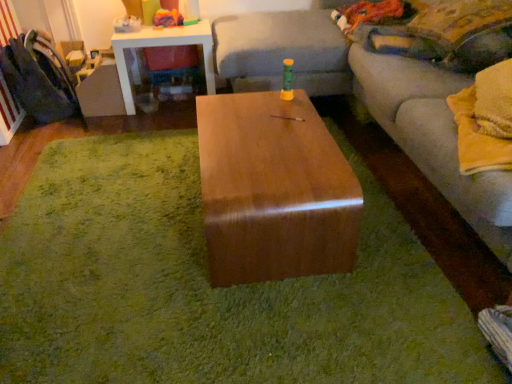
In order to face brown glossy wood table at center, should I rotate leftwards or rightwards?

Rotate left and turn 6.972 degrees.

Where is `shiny brown wood coffee table at center`? shiny brown wood coffee table at center is located at coordinates (274, 190).

Where is `white glossy side table at upper left`? The image size is (512, 384). white glossy side table at upper left is located at coordinates (162, 46).

Consider the image. Measure the distance between point (188, 21) and camera.

Point (188, 21) and camera are 8.64 feet apart from each other.

Identify the location of matte gray couch at center. (371, 101).

Identify the location of velvet yellow pillow at upper right. (459, 22).

Between brown glossy wood table at center and shiny brown wood coffee table at center, which one has smaller size?

brown glossy wood table at center.

Considering the relative sizes of brown glossy wood table at center and shiny brown wood coffee table at center in the image provided, is brown glossy wood table at center taller than shiny brown wood coffee table at center?

No.

Is brown glossy wood table at center positioned behind shiny brown wood coffee table at center?

No, brown glossy wood table at center is closer to the camera.

From a real-world perspective, which object rests below the other?

brown glossy wood table at center.

From a real-world perspective, which object rests below the other?

From a 3D spatial view, rubberized plastic toy at upper left is below.

From the image's perspective, is rubberized plastic toy at upper left located beneath velvet yellow pillow at upper right?

No, from the image's perspective, rubberized plastic toy at upper left is not below velvet yellow pillow at upper right.

Is velvet yellow pillow at upper right at the back of rubberized plastic toy at upper left?

rubberized plastic toy at upper left does not have its back to velvet yellow pillow at upper right.

This screenshot has width=512, height=384. Identify the location of pillow above the rubberized plastic toy at upper left (from a real-world perspective). (459, 22).

Could you tell me if shiny brown wood coffee table at center is facing white glossy side table at upper left?

No, shiny brown wood coffee table at center does not turn towards white glossy side table at upper left.

From the picture: Who is shorter, shiny brown wood coffee table at center or white glossy side table at upper left?

shiny brown wood coffee table at center.

Is white glossy side table at upper left surrounded by shiny brown wood coffee table at center?

No, white glossy side table at upper left is located outside of shiny brown wood coffee table at center.

Considering the relative sizes of shiny brown wood coffee table at center and white glossy side table at upper left in the image provided, is shiny brown wood coffee table at center thinner than white glossy side table at upper left?

Yes, shiny brown wood coffee table at center is thinner than white glossy side table at upper left.

Is velvet yellow pillow at upper right oriented away from shiny brown wood coffee table at center?

No, velvet yellow pillow at upper right is not facing the opposite direction of shiny brown wood coffee table at center.

How distant is velvet yellow pillow at upper right from shiny brown wood coffee table at center?

A distance of 97.72 centimeters exists between velvet yellow pillow at upper right and shiny brown wood coffee table at center.

Which is more to the left, velvet yellow pillow at upper right or shiny brown wood coffee table at center?

Positioned to the left is shiny brown wood coffee table at center.

Between velvet yellow pillow at upper right and shiny brown wood coffee table at center, which one has larger size?

shiny brown wood coffee table at center is bigger.

Is white glossy side table at upper left oriented away from shiny brown wood coffee table at center?

No.

Does white glossy side table at upper left have a greater width compared to shiny brown wood coffee table at center?

Yes, white glossy side table at upper left is wider than shiny brown wood coffee table at center.

Where is `table on the left of the shiny brown wood coffee table at center`? This screenshot has height=384, width=512. table on the left of the shiny brown wood coffee table at center is located at coordinates (162, 46).

From the image's perspective, is white glossy side table at upper left positioned above or below shiny brown wood coffee table at center?

From the image's perspective, white glossy side table at upper left appears above shiny brown wood coffee table at center.

From the image's perspective, which object appears higher, brown glossy wood table at center or matte gray couch at center?

From the image's view, matte gray couch at center is above.

Considering the relative positions of brown glossy wood table at center and matte gray couch at center in the image provided, is brown glossy wood table at center in front of matte gray couch at center?

No, it is not.

Identify the location of studio couch above the brown glossy wood table at center (from the image's perspective). This screenshot has height=384, width=512. (371, 101).

In the scene shown: Is brown glossy wood table at center oriented away from matte gray couch at center?

No, brown glossy wood table at center's orientation is not away from matte gray couch at center.

Which is more to the left, white glossy side table at upper left or brown glossy wood table at center?

white glossy side table at upper left.

Is white glossy side table at upper left next to brown glossy wood table at center?

No, white glossy side table at upper left is not in contact with brown glossy wood table at center.

Considering the sizes of objects white glossy side table at upper left and brown glossy wood table at center in the image provided, who is smaller, white glossy side table at upper left or brown glossy wood table at center?

brown glossy wood table at center is smaller.

Would you say white glossy side table at upper left is inside or outside brown glossy wood table at center?

white glossy side table at upper left exists outside the volume of brown glossy wood table at center.

The width and height of the screenshot is (512, 384). Find the location of `mat lying in front of the shiny brown wood coffee table at center`. mat lying in front of the shiny brown wood coffee table at center is located at coordinates (208, 287).

You are a GUI agent. You are given a task and a screenshot of the screen. Output one action in this format:
    pyautogui.click(x=<x>, y=<y>)
    Task: Click on the toy behind the velvet yellow pillow at upper right
    
    Given the screenshot: What is the action you would take?
    pyautogui.click(x=172, y=19)

From the image, which object appears to be nearer to matte gray couch at center, shiny brown wood coffee table at center or white glossy side table at upper left?

shiny brown wood coffee table at center.

Considering their positions, is velvet yellow pillow at upper right positioned closer to white glossy side table at upper left than velvet dark blue swivel chair at left?

Among the two, velvet dark blue swivel chair at left is located nearer to white glossy side table at upper left.

Based on their spatial positions, is rubberized plastic toy at upper left or white glossy side table at upper left further from velvet dark blue swivel chair at left?

rubberized plastic toy at upper left.

Consider the image. Considering their positions, is brown glossy wood table at center positioned closer to shiny brown wood coffee table at center than matte gray couch at center?

Based on the image, brown glossy wood table at center appears to be nearer to shiny brown wood coffee table at center.

In the scene shown: Based on their spatial positions, is matte gray couch at center or brown glossy wood table at center closer to rubberized plastic toy at upper left?

Among the two, matte gray couch at center is located nearer to rubberized plastic toy at upper left.

From the image, which object appears to be farther from white glossy side table at upper left, velvet dark blue swivel chair at left or matte gray couch at center?

Among the two, matte gray couch at center is located further to white glossy side table at upper left.

Which object lies further to the anchor point brown glossy wood table at center, velvet dark blue swivel chair at left or velvet yellow pillow at upper right?

velvet dark blue swivel chair at left is further to brown glossy wood table at center.

From the image, which object appears to be nearer to rubberized plastic toy at upper left, velvet yellow pillow at upper right or velvet dark blue swivel chair at left?

Among the two, velvet dark blue swivel chair at left is located nearer to rubberized plastic toy at upper left.

Locate an element on the screen. The image size is (512, 384). coffee table between velvet dark blue swivel chair at left and velvet yellow pillow at upper right in the horizontal direction is located at coordinates (274, 190).

Find the location of `coffee table between brown glossy wood table at center and velvet yellow pillow at upper right`. coffee table between brown glossy wood table at center and velvet yellow pillow at upper right is located at coordinates (274, 190).

This screenshot has height=384, width=512. I want to click on coffee table located between rubberized plastic toy at upper left and velvet yellow pillow at upper right in the left-right direction, so (274, 190).

Image resolution: width=512 pixels, height=384 pixels. I want to click on table located between velvet dark blue swivel chair at left and shiny brown wood coffee table at center in the left-right direction, so click(x=162, y=46).